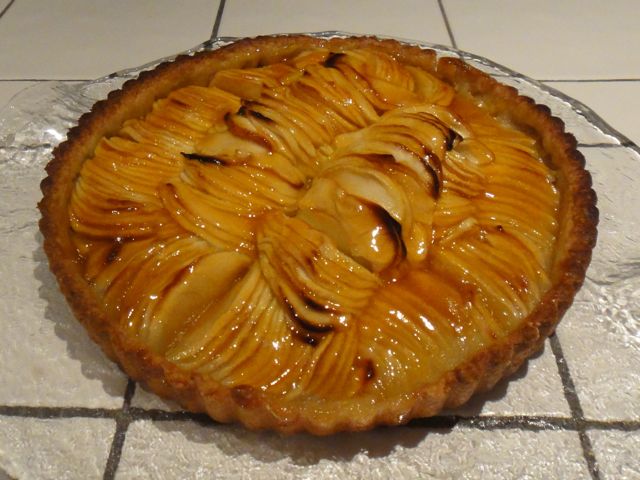
Identify the location of grout. The width and height of the screenshot is (640, 480). (577, 408), (580, 432).